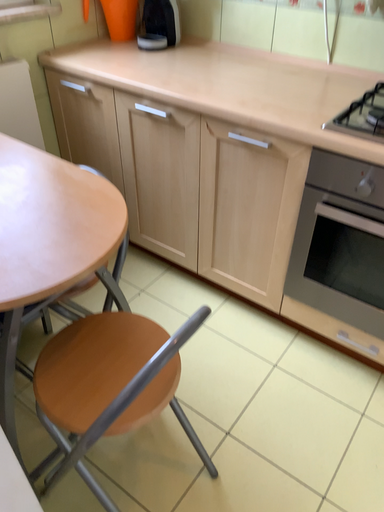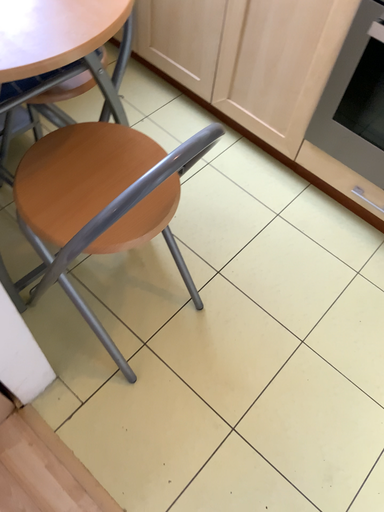
Question: How did the camera likely rotate when shooting the video?

Choices:
 (A) rotated upward
 (B) rotated downward

Answer: (B)